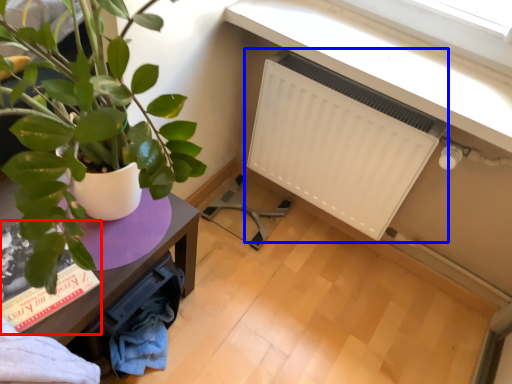
Question: Among these objects, which one is nearest to the camera, book (highlighted by a red box) or radiator (highlighted by a blue box)?

Choices:
 (A) book
 (B) radiator

Answer: (A)